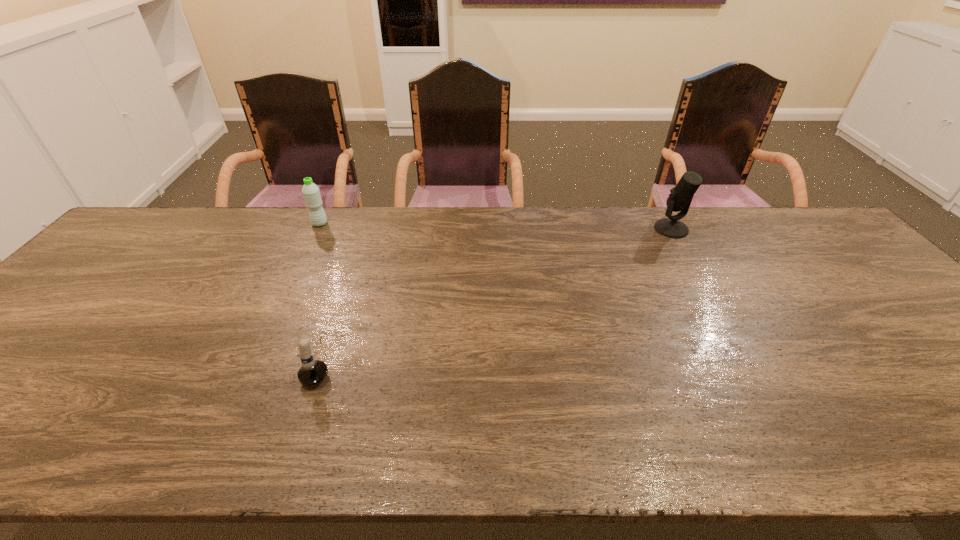
The image size is (960, 540). I want to click on water bottle that is positioned at the far edge, so click(312, 197).

Image resolution: width=960 pixels, height=540 pixels. In order to click on blank space at the far edge in this screenshot , I will do `click(359, 242)`.

The height and width of the screenshot is (540, 960). I want to click on free space at the near edge of the desktop, so click(891, 423).

The width and height of the screenshot is (960, 540). Identify the location of free spot at the left edge of the desktop. (42, 358).

Where is `vacant space at the right edge of the desktop`? Image resolution: width=960 pixels, height=540 pixels. vacant space at the right edge of the desktop is located at coordinates (900, 356).

The image size is (960, 540). I want to click on vacant space at the far left corner of the desktop, so click(x=176, y=232).

Image resolution: width=960 pixels, height=540 pixels. Identify the location of empty space that is in between the rightmost object and the left microphone. (496, 295).

At what (x,y) coordinates should I click in order to perform the action: click on vacant space that is in between the taller microphone and the second object from left to right. Please return your answer as a coordinate pair (x, y). The height and width of the screenshot is (540, 960). Looking at the image, I should click on (496, 295).

Locate an element on the screen. Image resolution: width=960 pixels, height=540 pixels. free point between the shorter microphone and the second shortest object is located at coordinates (320, 293).

Where is `vacant space that is in between the nearer microphone and the right microphone`? This screenshot has width=960, height=540. vacant space that is in between the nearer microphone and the right microphone is located at coordinates (496, 295).